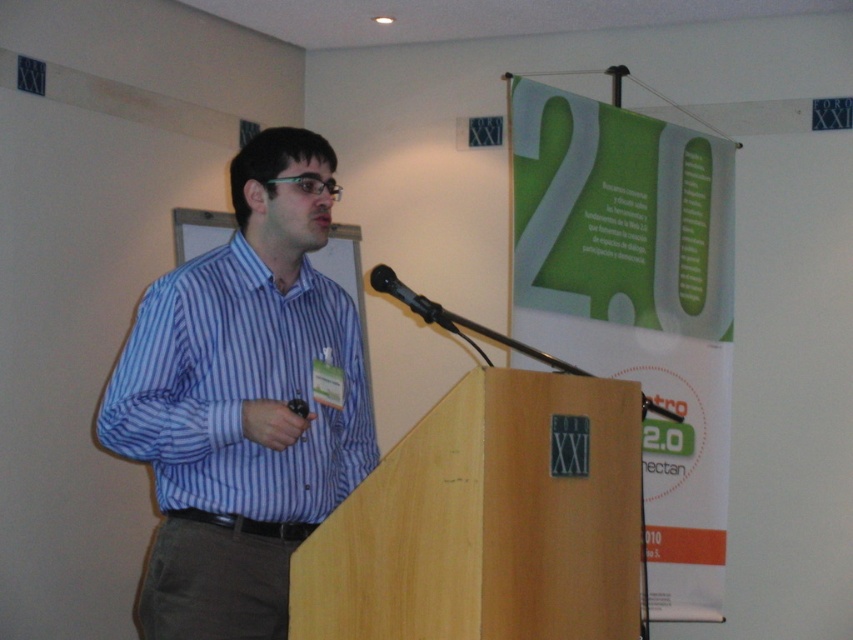
Question: Is blue striped shirt at center below black plastic microphone at center?

Choices:
 (A) yes
 (B) no

Answer: (A)

Question: Which object is farther from the camera taking this photo?

Choices:
 (A) black plastic microphone at center
 (B) blue striped shirt at center

Answer: (A)

Question: Which point is farther to the camera?

Choices:
 (A) (190, 260)
 (B) (374, 280)

Answer: (A)

Question: Which object appears closest to the camera in this image?

Choices:
 (A) black plastic microphone at center
 (B) blue striped shirt at center

Answer: (B)

Question: Observing the image, what is the correct spatial positioning of blue striped shirt at center in reference to black plastic microphone at center?

Choices:
 (A) right
 (B) left

Answer: (B)

Question: Can you confirm if blue striped shirt at center is bigger than black plastic microphone at center?

Choices:
 (A) no
 (B) yes

Answer: (B)